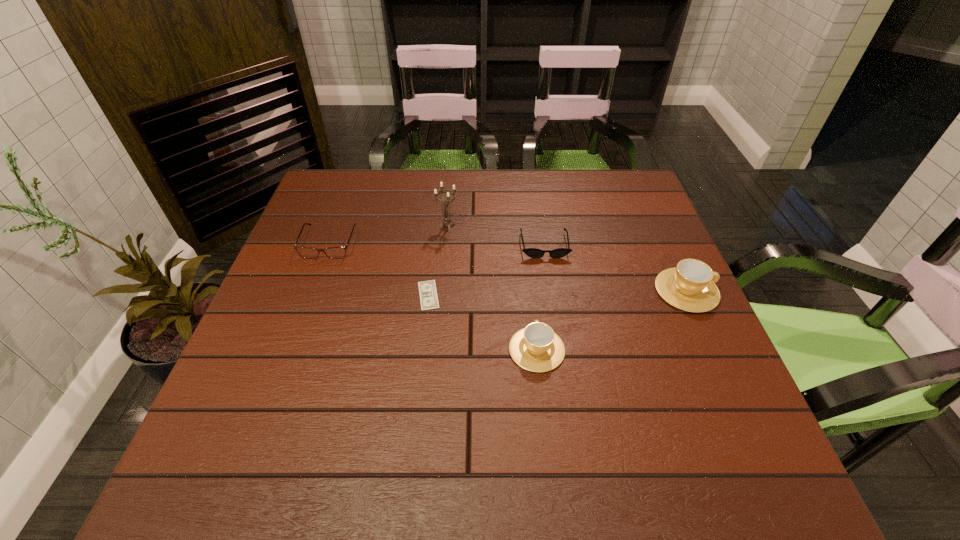
Image resolution: width=960 pixels, height=540 pixels. Identify the location of free space at the far left corner of the desktop. (362, 206).

Find the location of a particular element. The height and width of the screenshot is (540, 960). free space at the near left corner of the desktop is located at coordinates (275, 390).

Locate an element on the screen. vacant region at the far right corner of the desktop is located at coordinates (623, 211).

At what (x,y) coordinates should I click in order to perform the action: click on free space between the taller cup and the tallest object. Please return your answer as a coordinate pair (x, y). Image resolution: width=960 pixels, height=540 pixels. Looking at the image, I should click on (566, 258).

Find the location of a particular element. The height and width of the screenshot is (540, 960). free space between the leftmost object and the second tallest object is located at coordinates (508, 267).

Find the location of a particular element. free space between the fifth tallest object and the farther cup is located at coordinates (615, 267).

Locate an element on the screen. The width and height of the screenshot is (960, 540). free spot between the sunglasses and the farther cup is located at coordinates (615, 267).

The height and width of the screenshot is (540, 960). What are the coordinates of `free area in between the fifth tallest object and the nearer cup` in the screenshot? It's located at (540, 297).

Where is `free spot between the candle holder and the shorter cup`? Image resolution: width=960 pixels, height=540 pixels. free spot between the candle holder and the shorter cup is located at coordinates (492, 288).

The height and width of the screenshot is (540, 960). Identify the location of unoccupied position between the fifth tallest object and the shortest object. (486, 270).